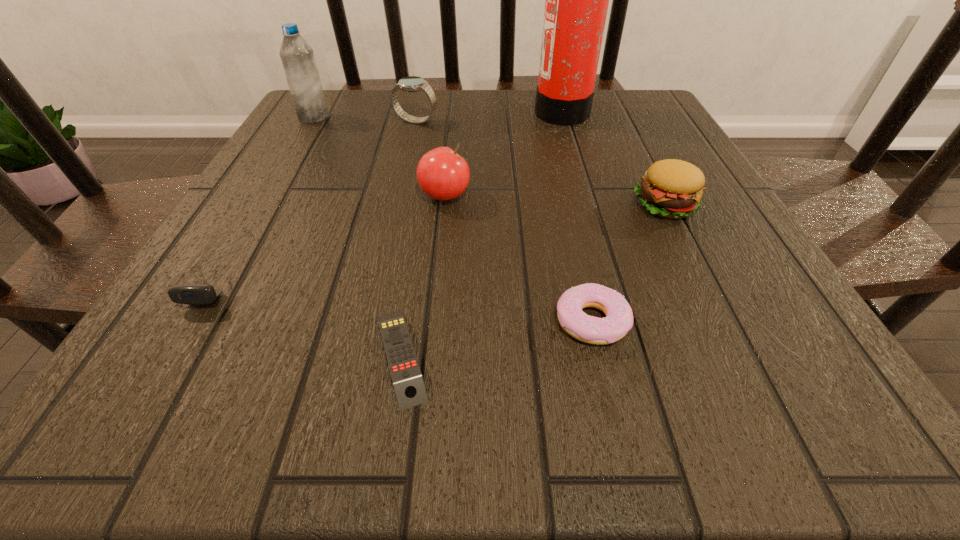
Locate an element on the screen. water bottle that is at the far edge is located at coordinates (297, 57).

Locate an element on the screen. This screenshot has height=540, width=960. watch that is at the far edge is located at coordinates (411, 83).

Identify the location of object at the near edge. This screenshot has width=960, height=540. (409, 387).

Locate an element on the screen. This screenshot has width=960, height=540. water bottle located at the left edge is located at coordinates (297, 57).

The width and height of the screenshot is (960, 540). In order to click on webcam located at the left edge in this screenshot , I will do `click(194, 294)`.

Identify the location of object that is at the right edge. (670, 188).

What are the coordinates of `object that is at the far left corner` in the screenshot? It's located at (297, 57).

Image resolution: width=960 pixels, height=540 pixels. I want to click on vacant region at the far edge, so click(x=461, y=126).

In the image, there is a desktop. Where is `vacant region at the near edge`? Image resolution: width=960 pixels, height=540 pixels. vacant region at the near edge is located at coordinates (646, 428).

In the image, there is a desktop. Where is `vacant area at the left edge`? The height and width of the screenshot is (540, 960). vacant area at the left edge is located at coordinates (274, 253).